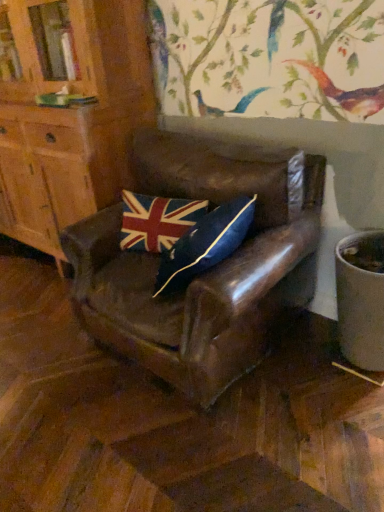
Question: Considering the positions of point (115, 216) and point (132, 224), is point (115, 216) closer or farther from the camera than point (132, 224)?

Choices:
 (A) closer
 (B) farther

Answer: (B)

Question: From a real-world perspective, is leather chair at center positioned above or below union jack fabric pillow at center?

Choices:
 (A) below
 (B) above

Answer: (A)

Question: Which is farther from the matte wood cabinet at left?

Choices:
 (A) union jack fabric pillow at center
 (B) leather chair at center

Answer: (B)

Question: Estimate the real-world distances between objects in this image. Which object is closer to the leather chair at center?

Choices:
 (A) union jack fabric pillow at center
 (B) matte wood cabinet at left

Answer: (A)